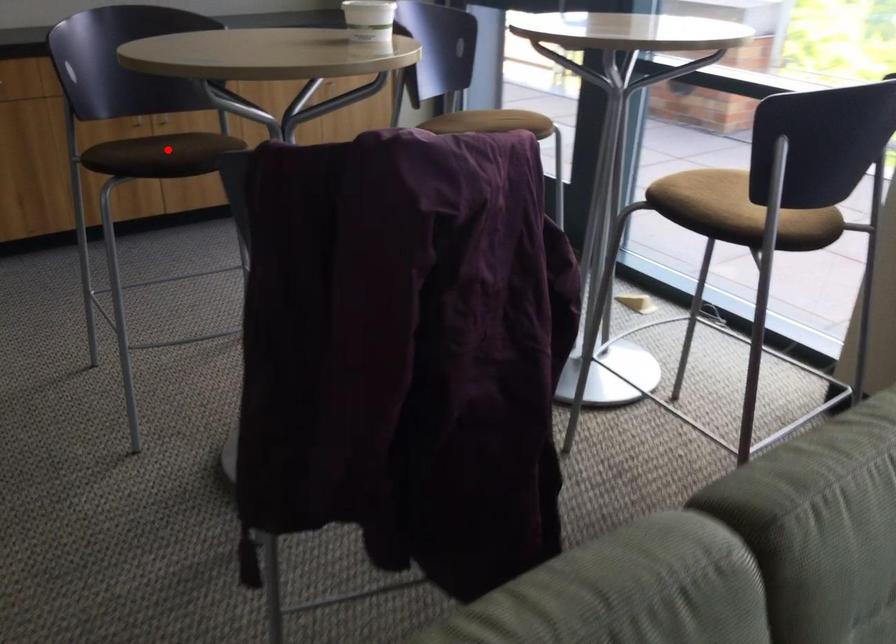
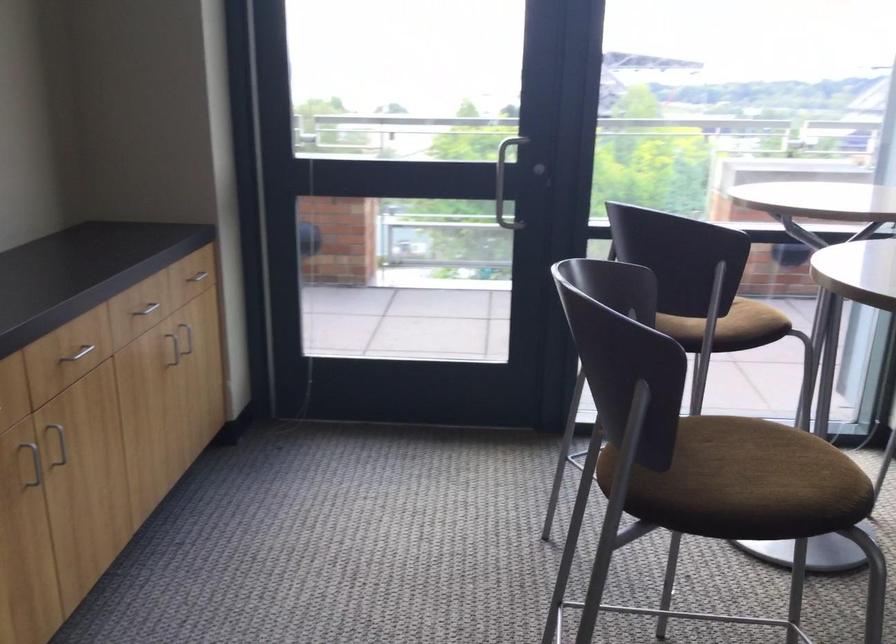
Question: I am providing you with two images of the same scene from different viewpoints. A red point is shown in image1. For the corresponding object point in image2, is it positioned nearer or farther from the camera?

Choices:
 (A) Nearer
 (B) Farther

Answer: (A)